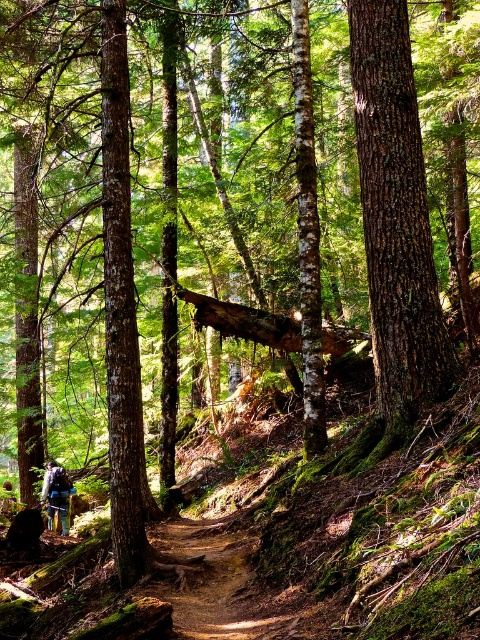
You are a hiker who wants to follow the brown dirt trail at center to reach a viewpoint. You see the blue fabric backpack at lower left on the ground. Can you step over the backpack to stay on the trail?

The brown dirt trail at center is located above the blue fabric backpack at lower left, so yes, you can step over the backpack to stay on the trail since the trail is positioned higher than the backpack.

You are a hiker who just arrived at the forest and see the brown rough bark tree at center and the blue fabric backpack at lower left. Which object is bigger in size?

The brown rough bark tree at center is larger in size compared to the blue fabric backpack at lower left.

You are a hiker walking along the narrow dirt path in the forest. You notice a brown rough bark tree at center and a brown dirt trail at center. Which object is closer to you as you walk?

The brown rough bark tree at center is closer to you since it is in front of the brown dirt trail at center.